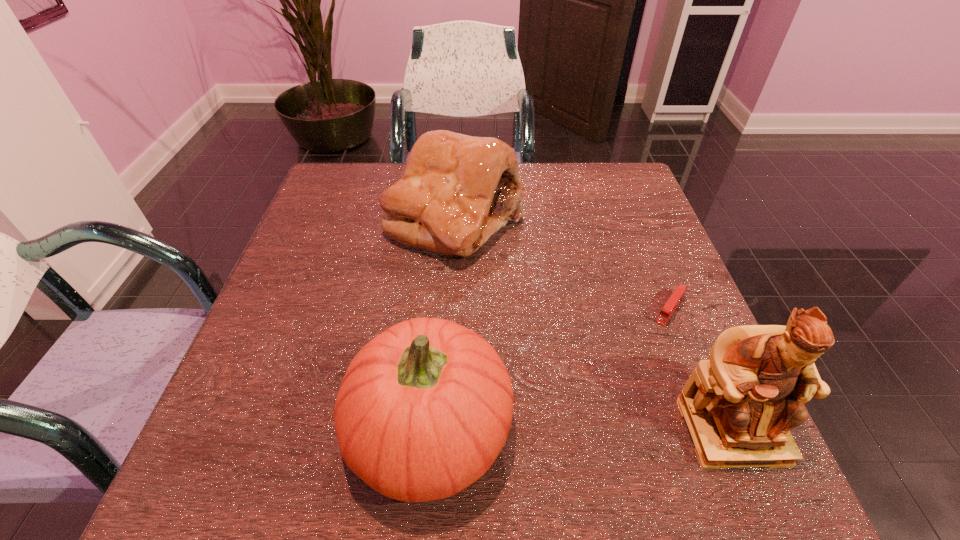
You are a GUI agent. You are given a task and a screenshot of the screen. Output one action in this format:
    pyautogui.click(x=<x>, y=<y>)
    Task: Click on the vacant space located 0.240m on the front-facing side of the stapler
    
    Given the screenshot: What is the action you would take?
    pyautogui.click(x=608, y=406)

Where is `free space located on the front-facing side of the stapler`? free space located on the front-facing side of the stapler is located at coordinates (608, 406).

Locate an element on the screen. This screenshot has height=540, width=960. free space located 0.170m on the front-facing side of the stapler is located at coordinates pyautogui.click(x=626, y=379).

Find the location of a particular element. Image resolution: width=960 pixels, height=540 pixels. object that is at the far edge is located at coordinates (457, 190).

Where is `pumpkin at the near edge`? pumpkin at the near edge is located at coordinates (424, 409).

I want to click on figurine that is at the near edge, so click(739, 406).

Where is `figurine that is at the right edge`? figurine that is at the right edge is located at coordinates (739, 406).

Where is `stapler that is at the right edge`? The width and height of the screenshot is (960, 540). stapler that is at the right edge is located at coordinates (678, 294).

The height and width of the screenshot is (540, 960). What are the coordinates of `object that is at the near right corner` in the screenshot? It's located at (739, 406).

Identify the location of free point at the far edge. (399, 163).